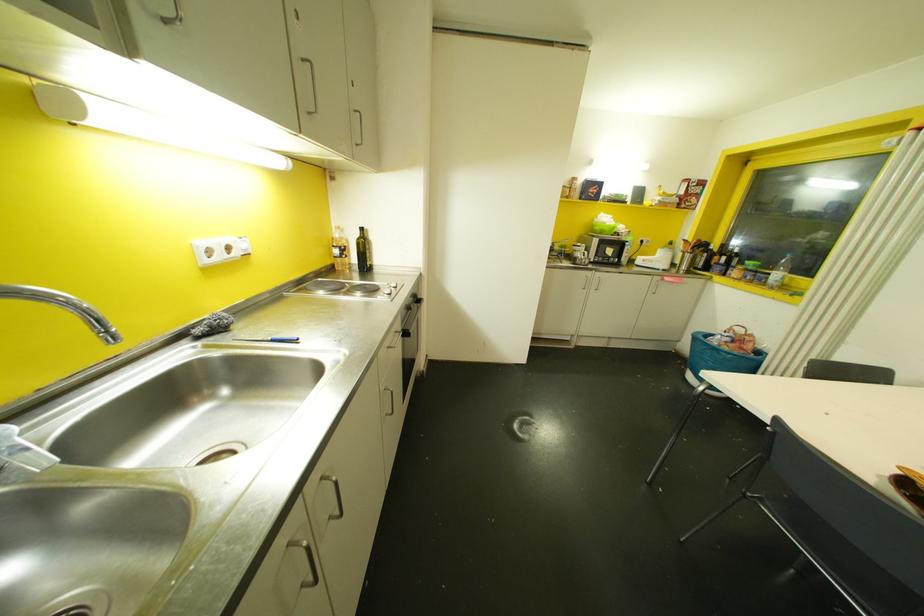
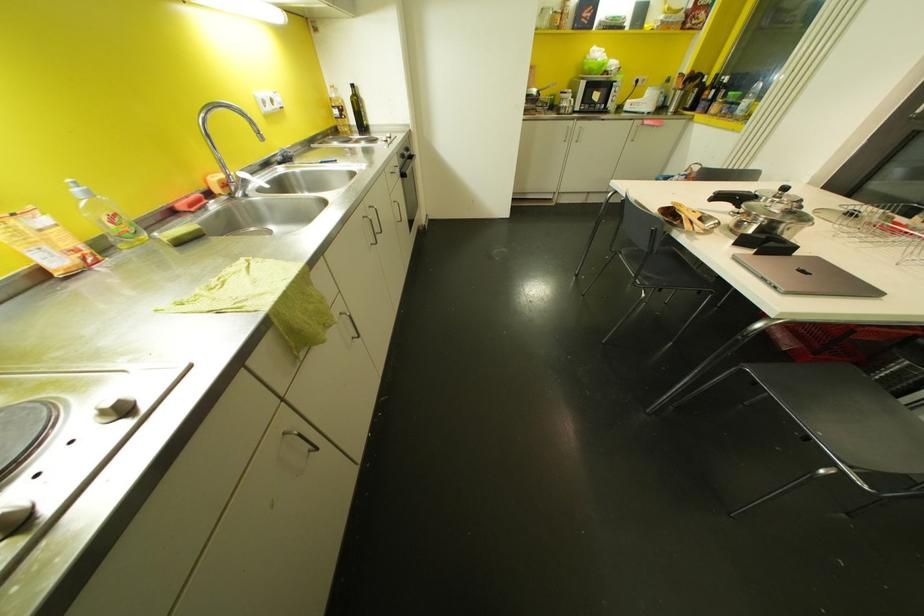
Find the pixel in the second image that matches point (360, 229) in the first image.

(353, 84)